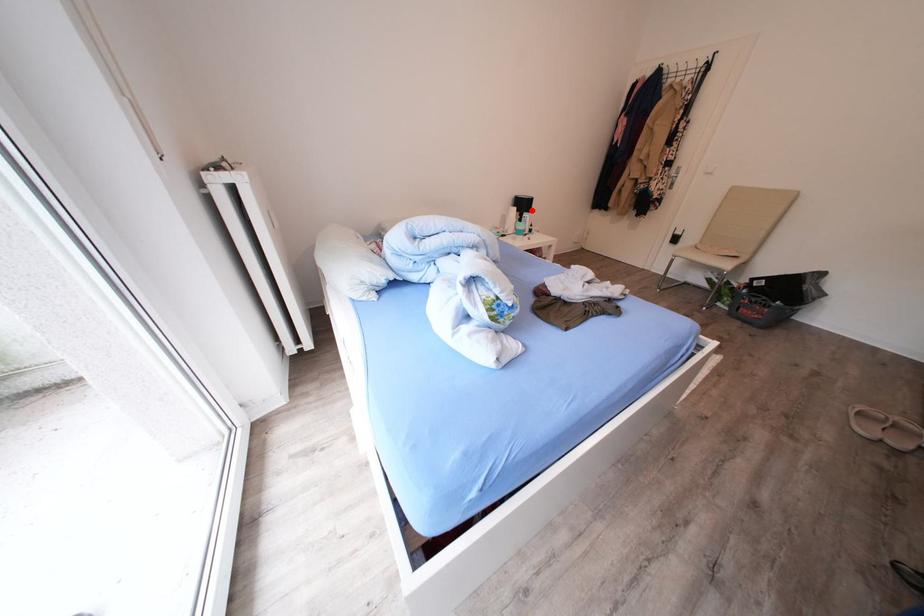
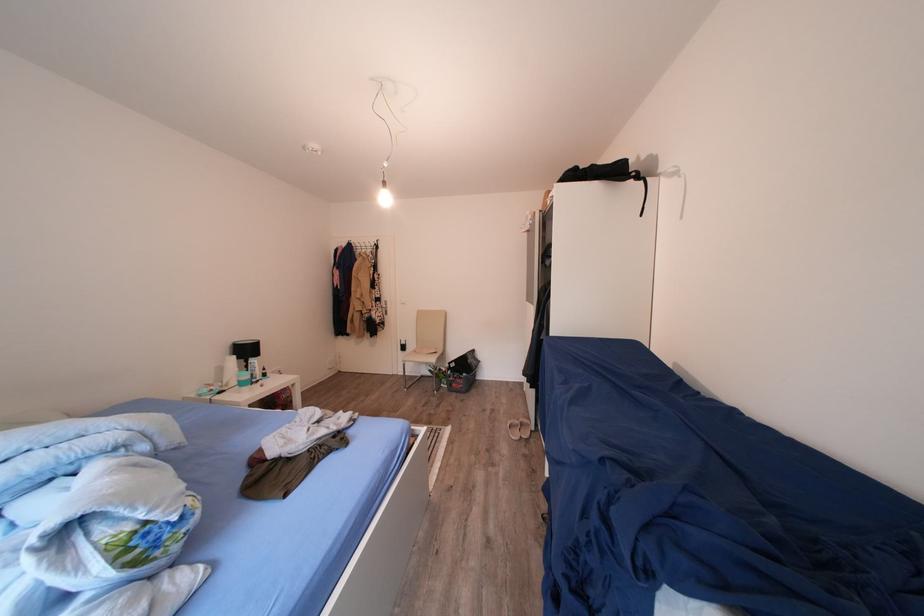
Find the pixel in the second image that matches the highlighted location in the first image.

(256, 355)